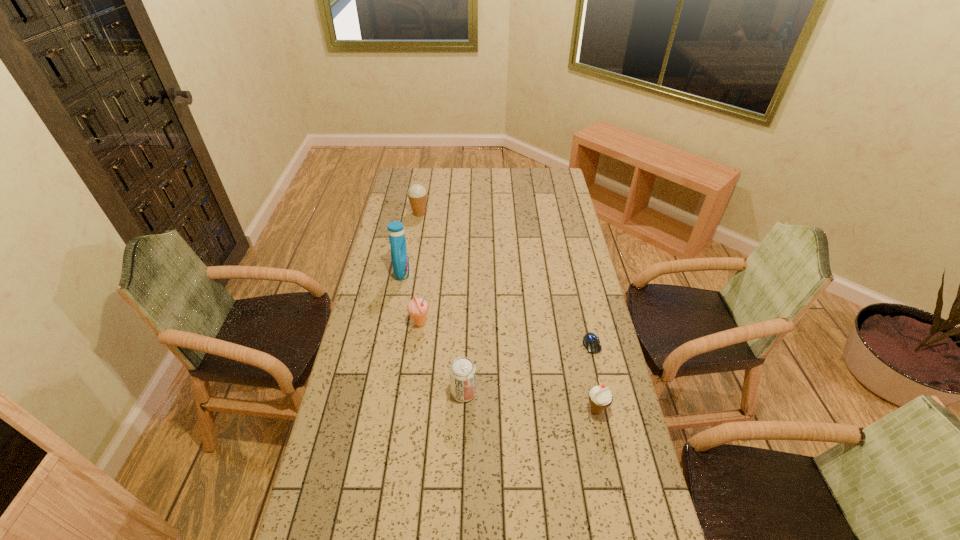
Find the location of a particular element. The image size is (960, 540). vacant area at the far right corner of the desktop is located at coordinates (542, 178).

You are a GUI agent. You are given a task and a screenshot of the screen. Output one action in this format:
    pyautogui.click(x=<x>, y=<y>)
    Task: Click on the free space between the computer mouse and the tallest object
    This screenshot has height=540, width=960.
    Given the screenshot: What is the action you would take?
    pyautogui.click(x=497, y=308)

Find the location of a particular element. empty space between the computer mouse and the rightmost icecream is located at coordinates (594, 377).

At what (x,y) coordinates should I click in order to perform the action: click on free space between the second farthest object and the fourth nearest object. Please return your answer as a coordinate pair (x, y). The height and width of the screenshot is (540, 960). Looking at the image, I should click on [x=411, y=298].

At what (x,y) coordinates should I click in order to perform the action: click on free space between the detergent and the farthest object. Please return your answer as a coordinate pair (x, y). This screenshot has height=540, width=960. Looking at the image, I should click on (411, 243).

At what (x,y) coordinates should I click in order to perform the action: click on vacant point located between the computer mouse and the third farthest object. Please return your answer as a coordinate pair (x, y). The width and height of the screenshot is (960, 540). Looking at the image, I should click on (506, 334).

Image resolution: width=960 pixels, height=540 pixels. In order to click on empty space that is in between the farthest object and the computer mouse in this screenshot , I will do `click(505, 279)`.

This screenshot has height=540, width=960. I want to click on empty space between the tallest object and the second nearest icecream, so click(x=411, y=298).

Where is `free space between the tallest object and the farthest object`? Image resolution: width=960 pixels, height=540 pixels. free space between the tallest object and the farthest object is located at coordinates (411, 243).

Locate an element on the screen. Image resolution: width=960 pixels, height=540 pixels. unoccupied area between the nearest icecream and the soda can is located at coordinates (530, 401).